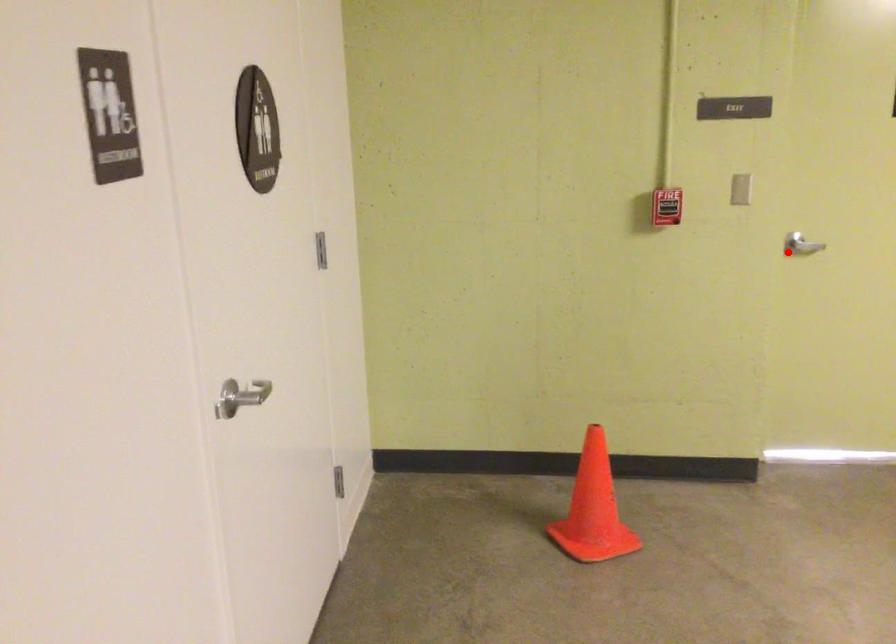
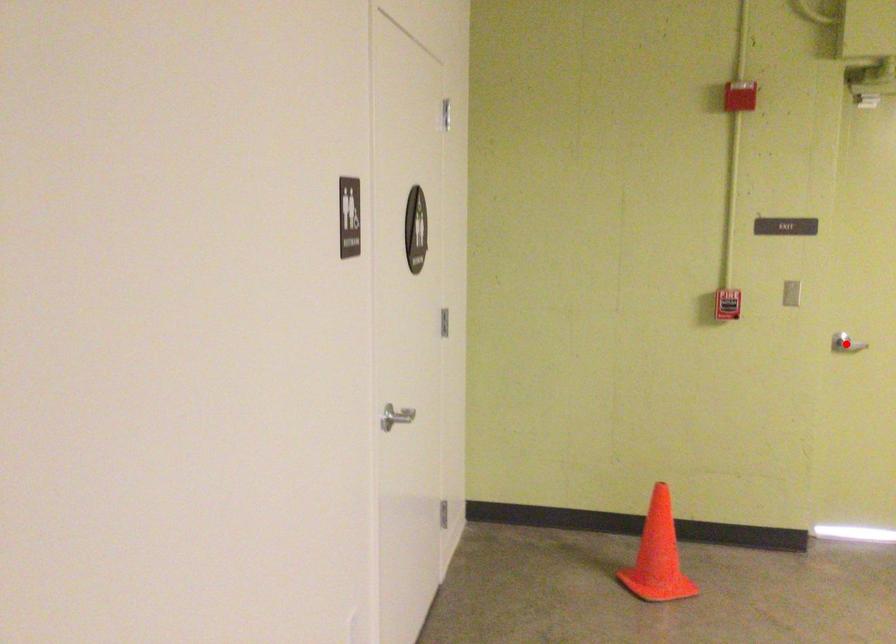
I am providing you with two images of the same scene from different viewpoints. A red point is marked on the first image and another point is marked on the second image. Is the red point in image1 aligned with the point shown in image2?

Yes